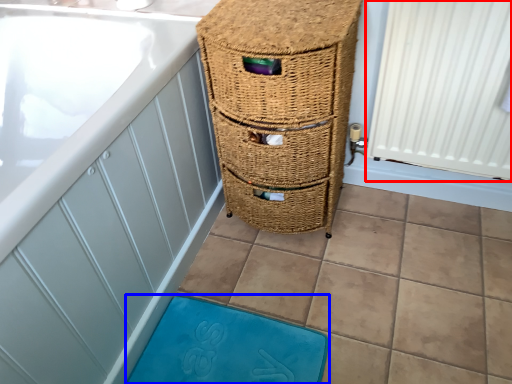
Question: Which of the following is the closest to the observer, radiator (highlighted by a red box) or bath mat (highlighted by a blue box)?

Choices:
 (A) radiator
 (B) bath mat

Answer: (A)